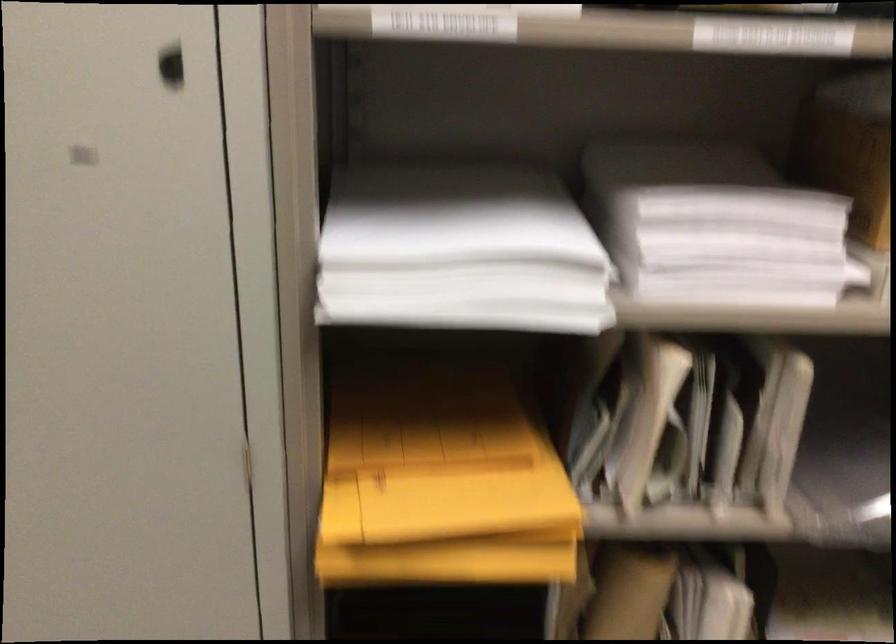
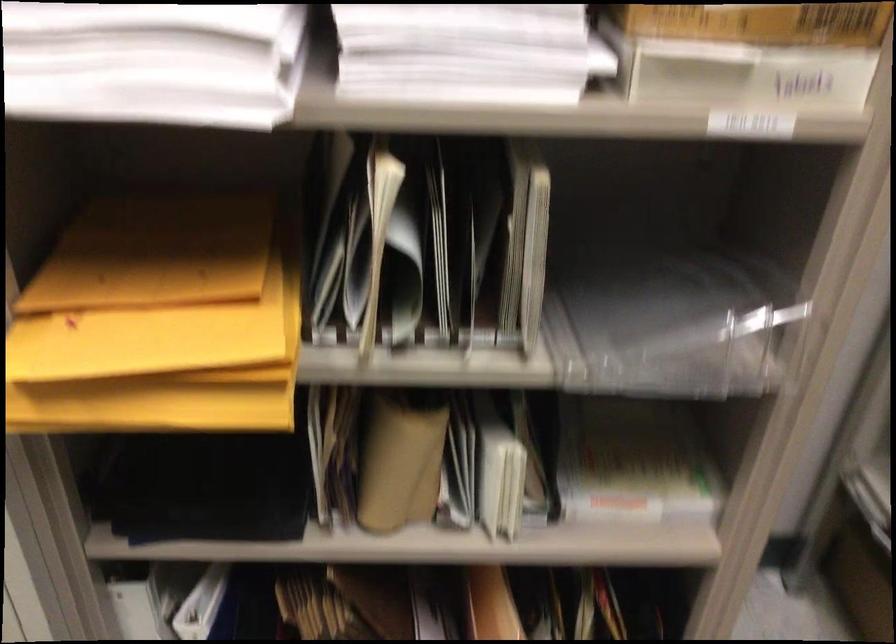
Question: What movement of the cameraman would produce the second image?

Choices:
 (A) Left
 (B) Right
 (C) Forward
 (D) Backward

Answer: (D)